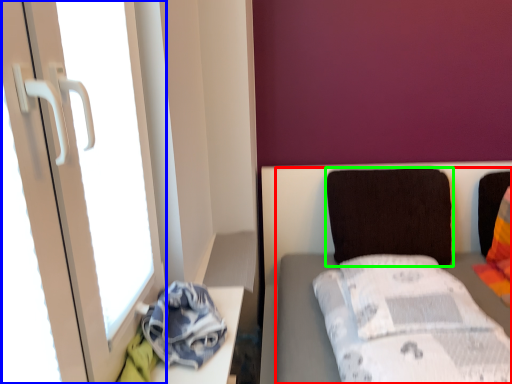
Question: Which object is the farthest from furniture (highlighted by a red box)? Choose among these: screen door (highlighted by a blue box) or pillow (highlighted by a green box).

Choices:
 (A) screen door
 (B) pillow

Answer: (A)